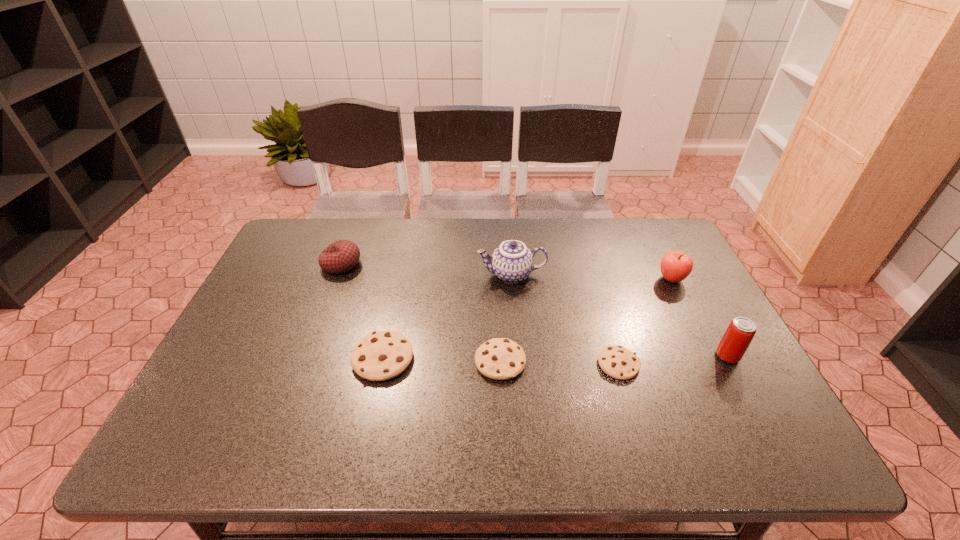
This screenshot has width=960, height=540. What are the coordinates of `chinaware that is at the far edge` in the screenshot? It's located at (512, 262).

At what (x,y) coordinates should I click in order to perform the action: click on beanbag located in the far edge section of the desktop. Please return your answer as a coordinate pair (x, y). Looking at the image, I should click on (341, 256).

What are the coordinates of `object situated at the left edge` in the screenshot? It's located at (341, 256).

Identify the location of apple present at the right edge. (675, 266).

Locate an element on the screen. The image size is (960, 540). beer can located at the right edge is located at coordinates (736, 339).

At what (x,y) coordinates should I click in order to perform the action: click on object situated at the far left corner. Please return your answer as a coordinate pair (x, y). The height and width of the screenshot is (540, 960). Looking at the image, I should click on (341, 256).

In the image, there is a desktop. Where is `vacant space at the far edge`? vacant space at the far edge is located at coordinates (408, 237).

Identify the location of blank space at the near edge. (346, 406).

In the image, there is a desktop. Identify the location of vacant space at the left edge. (261, 328).

Where is `free region at the right edge of the desktop`? The image size is (960, 540). free region at the right edge of the desktop is located at coordinates (696, 345).